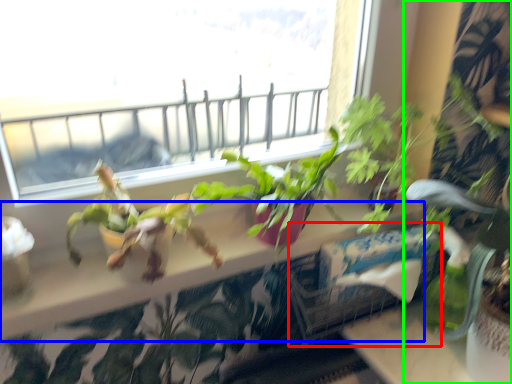
Question: Based on their relative distances, which object is farther from window box (highlighted by a red box)? Choose from window sill (highlighted by a blue box) and houseplant (highlighted by a green box).

Choices:
 (A) window sill
 (B) houseplant

Answer: (B)